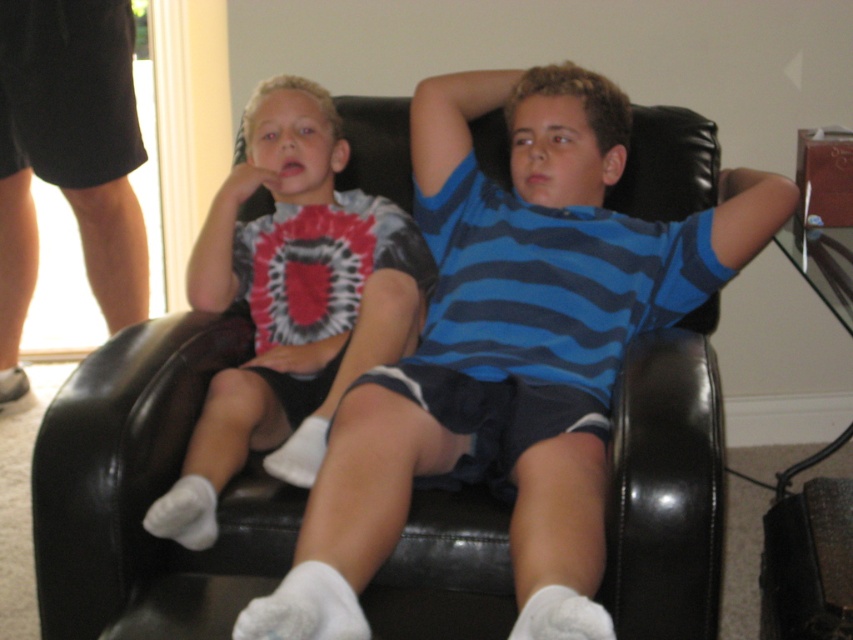
Can you confirm if blue striped shirt at center is positioned above tie-dye t-shirt at left?

Incorrect, blue striped shirt at center is not positioned above tie-dye t-shirt at left.

Does blue striped shirt at center have a greater width compared to tie-dye t-shirt at left?

Indeed, blue striped shirt at center has a greater width compared to tie-dye t-shirt at left.

This screenshot has height=640, width=853. Describe the element at coordinates (511, 349) in the screenshot. I see `blue striped shirt at center` at that location.

Find the location of a particular element. The height and width of the screenshot is (640, 853). blue striped shirt at center is located at coordinates point(511,349).